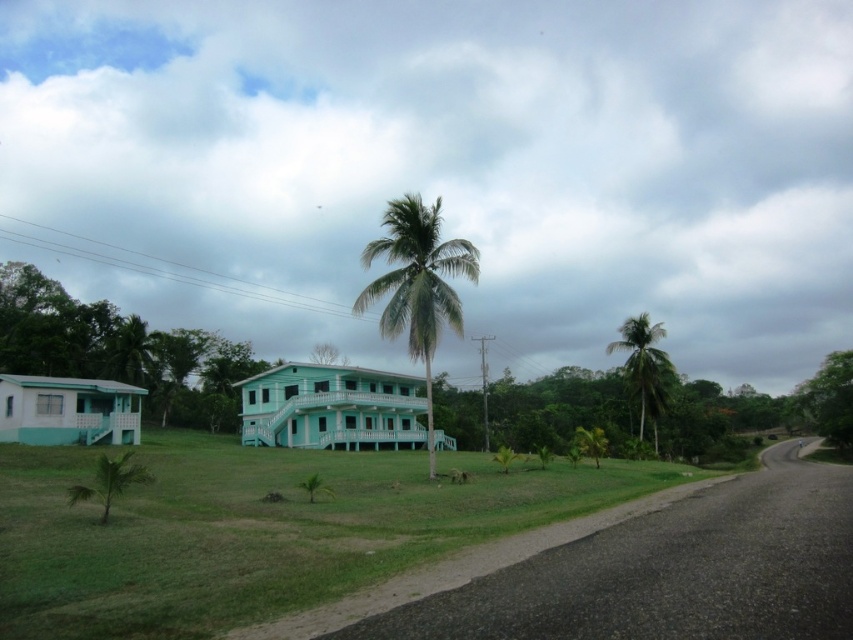
Can you confirm if green leafy palm at center is smaller than green leafy palm tree at right?

No, green leafy palm at center is not smaller than green leafy palm tree at right.

Which is below, green leafy palm at center or green leafy palm tree at right?

green leafy palm tree at right

You are a GUI agent. You are given a task and a screenshot of the screen. Output one action in this format:
    pyautogui.click(x=<x>, y=<y>)
    Task: Click on the green leafy palm at center
    Image resolution: width=853 pixels, height=640 pixels.
    Given the screenshot: What is the action you would take?
    pyautogui.click(x=416, y=284)